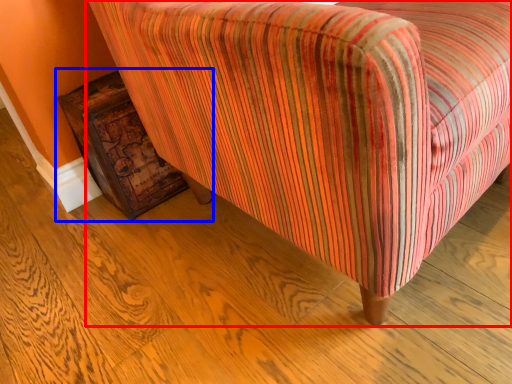
Question: Which object is closer to the camera taking this photo, chair (highlighted by a red box) or furniture (highlighted by a blue box)?

Choices:
 (A) chair
 (B) furniture

Answer: (A)